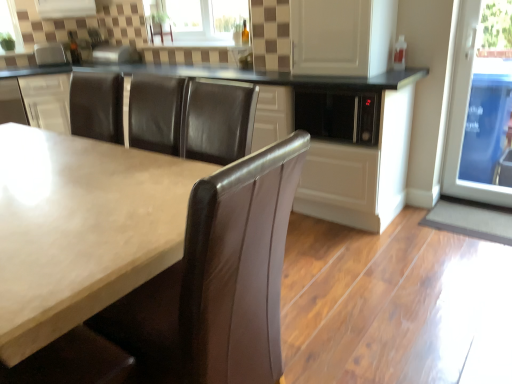
Question: From the image's perspective, relative to matte white countertop at center, is clear glass window at upper center above or below?

Choices:
 (A) below
 (B) above

Answer: (B)

Question: Considering the positions of clear glass window at upper center and matte white countertop at center in the image, is clear glass window at upper center wider or thinner than matte white countertop at center?

Choices:
 (A) thin
 (B) wide

Answer: (A)

Question: Considering the real-world distances, which object is farthest from the white glossy cabinet at center, the 1th cabinetry from the left?

Choices:
 (A) white glossy cabinet at upper center
 (B) matte white countertop at center
 (C) matte black microwave at center, which is the second cabinetry from left to right
 (D) transparent glass door at right
 (E) clear glass window at upper center

Answer: (D)

Question: Based on their relative distances, which object is nearer to the satin silver toaster at upper left?

Choices:
 (A) transparent glass door at right
 (B) clear glass window at upper center
 (C) white glossy cabinet at upper center
 (D) white glossy cabinet at center, the 1th cabinetry from the left
 (E) matte white countertop at center

Answer: (D)